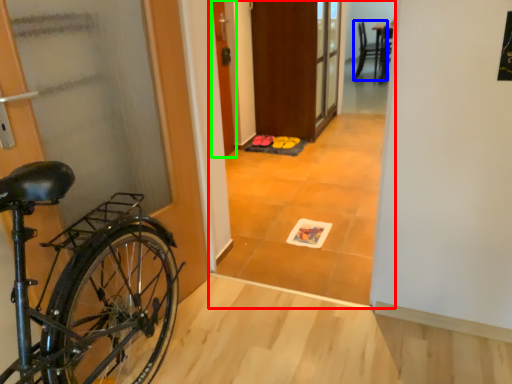
Question: Which object is the farthest from corridor (highlighted by a red box)? Choose among these: chair (highlighted by a blue box) or door (highlighted by a green box).

Choices:
 (A) chair
 (B) door

Answer: (A)